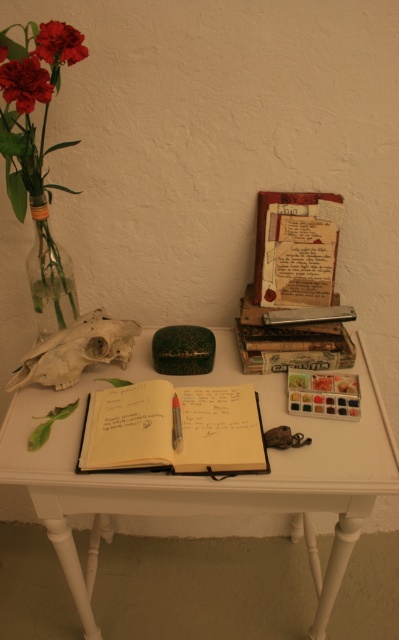
Which is in front, point (292, 310) or point (173, 426)?

Point (173, 426)

Who is positioned more to the left, metallic silver notebook at center or black plastic pen at center?

Positioned to the left is black plastic pen at center.

The height and width of the screenshot is (640, 399). What do you see at coordinates (308, 314) in the screenshot?
I see `metallic silver notebook at center` at bounding box center [308, 314].

At what (x,y) coordinates should I click in order to perform the action: click on metallic silver notebook at center. Please return your answer as a coordinate pair (x, y). Looking at the image, I should click on (308, 314).

Between point (31, 65) and point (264, 317), which one is positioned behind?

Point (264, 317)

Between matte red flower at upper left and metallic silver notebook at center, which one is positioned lower?

metallic silver notebook at center is lower down.

Who is more distant from viewer, (15, 61) or (304, 321)?

The point (304, 321) is more distant.

This screenshot has height=640, width=399. I want to click on matte red flower at upper left, so click(25, 83).

Is point (256, 499) positioned behind point (316, 317)?

No, (256, 499) is closer to viewer.

The image size is (399, 640). Describe the element at coordinates (209, 477) in the screenshot. I see `white wooden table at center` at that location.

At what (x,y) coordinates should I click in order to perform the action: click on white wooden table at center. Please return your answer as a coordinate pair (x, y). The width and height of the screenshot is (399, 640). Looking at the image, I should click on (209, 477).